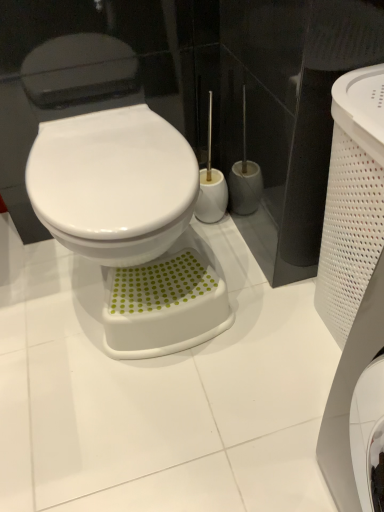
Find the location of a particular element. The image size is (384, 512). vacant space in front of green dotted plastic step stool at lower center is located at coordinates (161, 404).